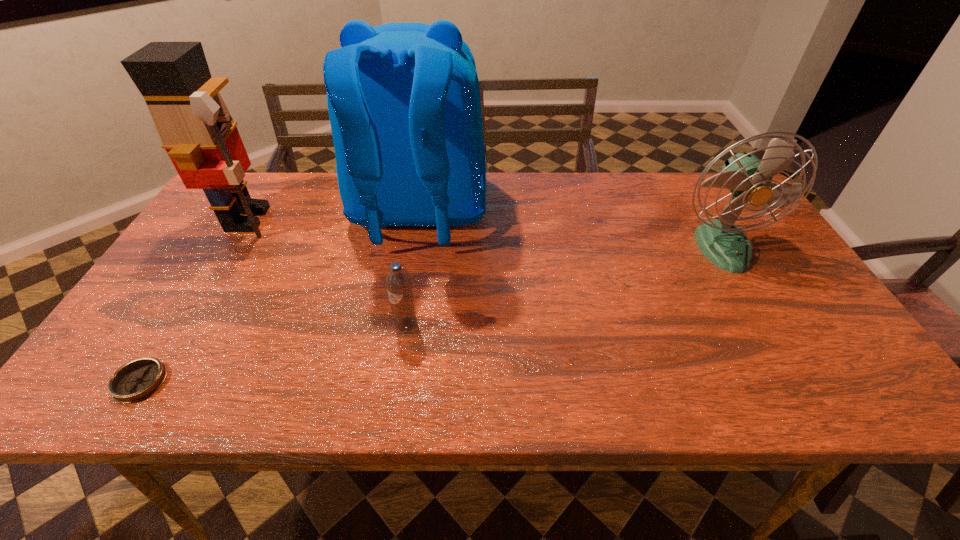
This screenshot has height=540, width=960. I want to click on blank space located in front of the third shortest object, directing airflow, so click(x=784, y=353).

Where is `vacant space located on the back of the fourth farthest object`? The width and height of the screenshot is (960, 540). vacant space located on the back of the fourth farthest object is located at coordinates (410, 301).

Locate an element on the screen. This screenshot has height=540, width=960. free space located 0.100m on the right of the nearest object is located at coordinates (214, 381).

Find the location of a particular element. This screenshot has height=540, width=960. backpack positioned at the far edge is located at coordinates (404, 104).

I want to click on nutcracker present at the far edge, so click(197, 131).

Locate an element on the screen. The image size is (960, 540). object positioned at the near edge is located at coordinates (138, 379).

You are a GUI agent. You are given a task and a screenshot of the screen. Output one action in this format:
    pyautogui.click(x=<x>, y=<y>)
    Task: Click on the nutcracker that is at the left edge
    
    Given the screenshot: What is the action you would take?
    pyautogui.click(x=197, y=131)

Identify the location of compass that is at the left edge. (138, 379).

Locate an element on the screen. This screenshot has width=960, height=540. object situated at the right edge is located at coordinates pyautogui.click(x=748, y=179).

Find the location of a particular element. This screenshot has width=960, height=540. object at the far left corner is located at coordinates (197, 131).